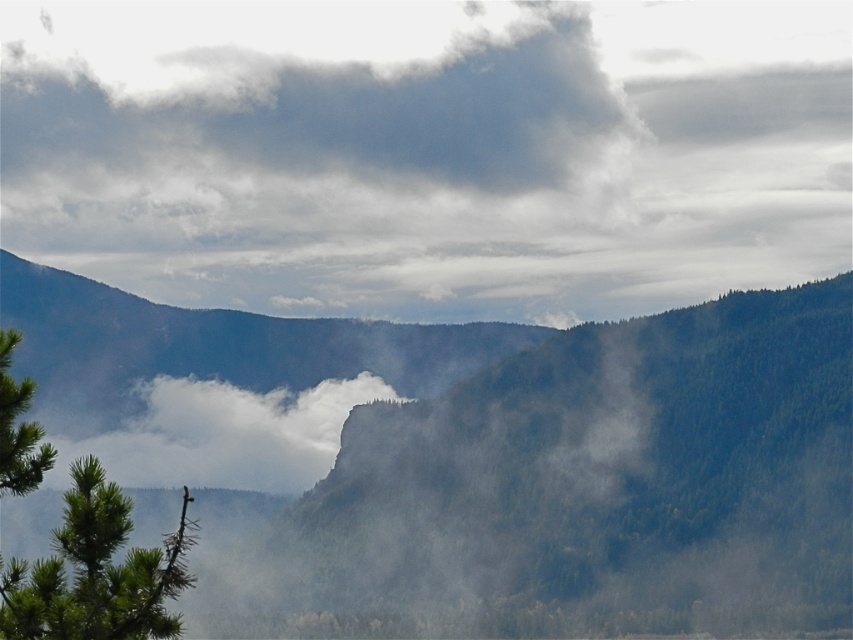
Which is more to the right, gray fluffy cloud at upper center or green forested mountain at center?

From the viewer's perspective, green forested mountain at center appears more on the right side.

Is gray fluffy cloud at upper center in front of green forested mountain at center?

No, gray fluffy cloud at upper center is further to the viewer.

Where is `gray fluffy cloud at upper center`? The image size is (853, 640). gray fluffy cloud at upper center is located at coordinates (427, 150).

Between gray fluffy cloud at upper center and white fluffy cloud at center, which one has more height?

gray fluffy cloud at upper center is taller.

Can you confirm if gray fluffy cloud at upper center is smaller than white fluffy cloud at center?

Actually, gray fluffy cloud at upper center might be larger than white fluffy cloud at center.

Which is behind, point (123, 65) or point (146, 461)?

The point (123, 65) is more distant.

Find the location of a particular element. Image resolution: width=853 pixels, height=640 pixels. gray fluffy cloud at upper center is located at coordinates (427, 150).

How far apart are green forested mountain at center and green needle-like tree at left?

They are 523.60 meters apart.

Is green forested mountain at center in front of green needle-like tree at left?

No, green forested mountain at center is further to the viewer.

Is point (850, 451) farther from viewer compared to point (6, 378)?

Yes, it is.

You are a GUI agent. You are given a task and a screenshot of the screen. Output one action in this format:
    pyautogui.click(x=<x>, y=<y>)
    Task: Click on the green forested mountain at center
    The height and width of the screenshot is (640, 853).
    Given the screenshot: What is the action you would take?
    pyautogui.click(x=577, y=484)